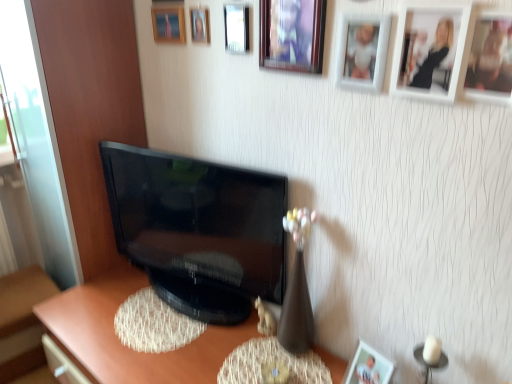
Question: Considering the relative positions of white plastic dog at lower center and wooden photo frame at upper right, marked as the 2th picture frame in a bottom-to-top arrangement, in the image provided, is white plastic dog at lower center to the left of wooden photo frame at upper right, marked as the 2th picture frame in a bottom-to-top arrangement, from the viewer's perspective?

Choices:
 (A) yes
 (B) no

Answer: (A)

Question: Is white plastic dog at lower center bigger than wooden photo frame at upper right, marked as the 8th picture frame in a left-to-right arrangement?

Choices:
 (A) no
 (B) yes

Answer: (A)

Question: Would you say white plastic dog at lower center is outside wooden photo frame at upper right, which is the 7th picture frame from top to bottom?

Choices:
 (A) yes
 (B) no

Answer: (A)

Question: Is wooden photo frame at upper right, marked as the 8th picture frame in a left-to-right arrangement, surrounded by white plastic dog at lower center?

Choices:
 (A) no
 (B) yes

Answer: (A)

Question: Is white plastic dog at lower center thinner than wooden photo frame at upper right, marked as the 8th picture frame in a left-to-right arrangement?

Choices:
 (A) yes
 (B) no

Answer: (B)

Question: Relative to wooden picture frame at upper center, the first picture frame viewed from the left, is matte white picture frame at lower right, the 1th picture frame positioned from the bottom, in front or behind?

Choices:
 (A) behind
 (B) front

Answer: (B)

Question: From a real-world perspective, is matte white picture frame at lower right, the 1th picture frame positioned from the bottom, physically located above or below wooden picture frame at upper center, the 1th picture frame in the top-to-bottom sequence?

Choices:
 (A) above
 (B) below

Answer: (B)

Question: In the image, is matte white picture frame at lower right, the 3th picture frame positioned from the right, on the left side or the right side of wooden picture frame at upper center, the first picture frame viewed from the left?

Choices:
 (A) left
 (B) right

Answer: (B)

Question: Is matte white picture frame at lower right, the sixth picture frame in the left-to-right sequence, bigger or smaller than wooden picture frame at upper center, which ranks as the 8th picture frame in bottom-to-top order?

Choices:
 (A) big
 (B) small

Answer: (A)

Question: Based on their positions, is matte brown desk at center located to the left or right of black glossy television at center?

Choices:
 (A) right
 (B) left

Answer: (B)

Question: In the image, is matte brown desk at center positioned in front of or behind black glossy television at center?

Choices:
 (A) front
 (B) behind

Answer: (A)

Question: Choose the correct answer: Is matte brown desk at center inside black glossy television at center or outside it?

Choices:
 (A) outside
 (B) inside

Answer: (A)

Question: From the image's perspective, is matte brown desk at center above or below black glossy television at center?

Choices:
 (A) above
 (B) below

Answer: (B)

Question: From a real-world perspective, relative to black glossy television at center, is matte white picture frame at lower right, the 1th picture frame positioned from the bottom, vertically above or below?

Choices:
 (A) below
 (B) above

Answer: (A)

Question: Is point (347, 380) closer or farther from the camera than point (204, 225)?

Choices:
 (A) closer
 (B) farther

Answer: (A)